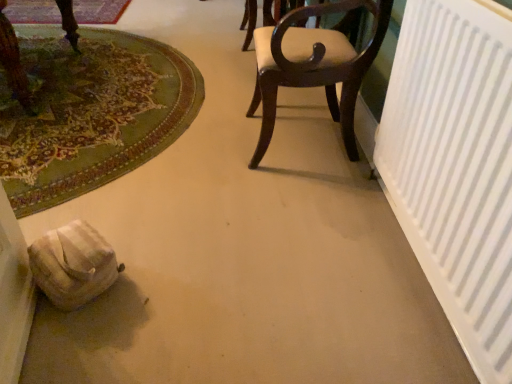
Question: Is point (272, 112) positioned closer to the camera than point (62, 201)?

Choices:
 (A) closer
 (B) farther

Answer: (B)

Question: Considering the positions of dark wood chair at center and green carpet at lower left, which is the first mat in front-to-back order, in the image, is dark wood chair at center wider or thinner than green carpet at lower left, which is the first mat in front-to-back order,?

Choices:
 (A) wide
 (B) thin

Answer: (B)

Question: Considering the real-world distances, which object is closest to the dark wood chair at center?

Choices:
 (A) carpeted mat at upper left, the second mat from the front
 (B) white matte radiator at right
 (C) green carpet at lower left, positioned as the 1th mat in bottom-to-top order

Answer: (B)

Question: Estimate the real-world distances between objects in this image. Which object is farther from the carpeted mat at upper left, the second mat from the front?

Choices:
 (A) green carpet at lower left, the second mat positioned from the back
 (B) white matte radiator at right
 (C) dark wood chair at center

Answer: (B)